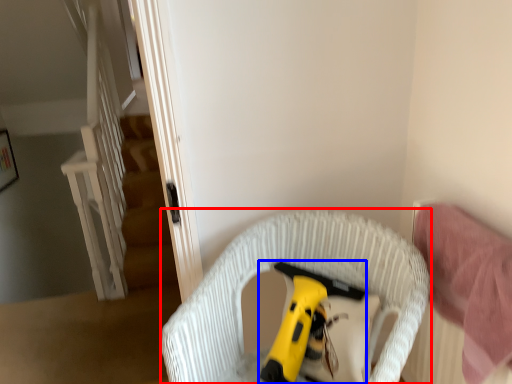
Question: Among these objects, which one is nearest to the camera, furniture (highlighted by a red box) or toy (highlighted by a blue box)?

Choices:
 (A) furniture
 (B) toy

Answer: (A)